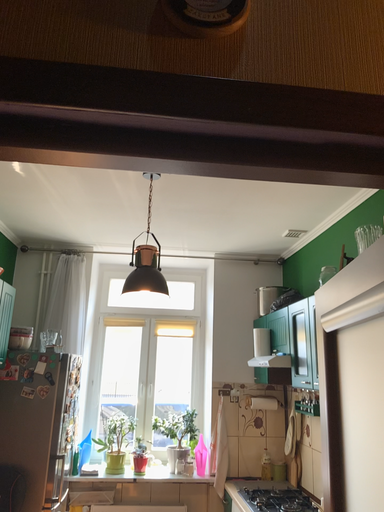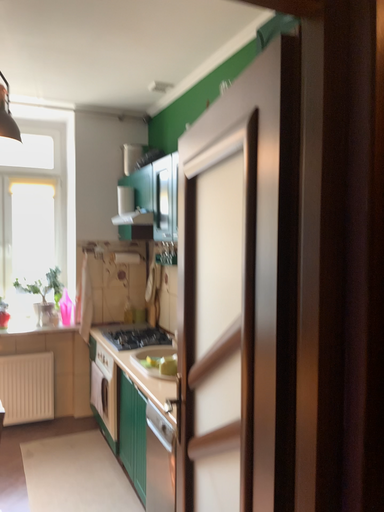
Question: How did the camera likely rotate when shooting the video?

Choices:
 (A) rotated left
 (B) rotated right

Answer: (B)